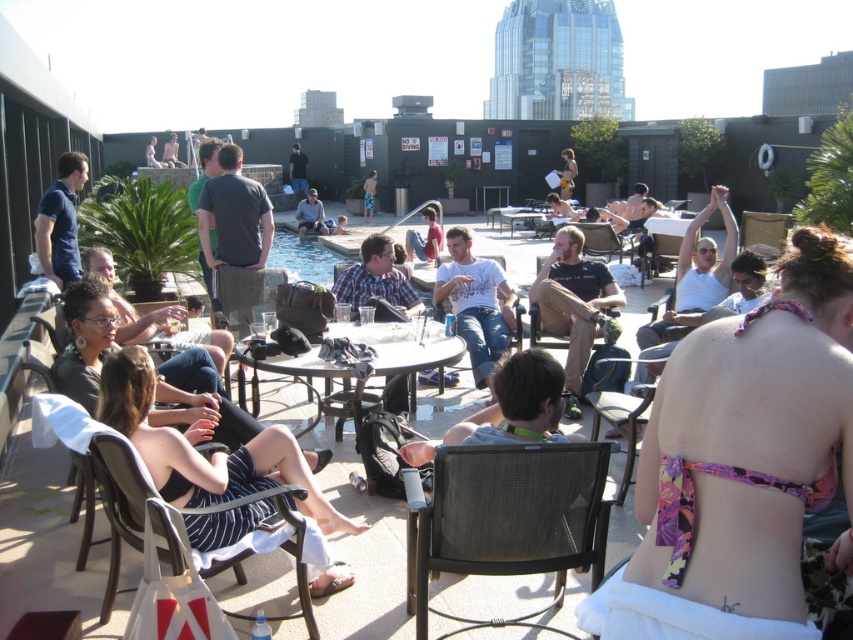
You are standing at the edge of the pool and want to grab your yellow fabric shirt at center to dry off. There is a matte black chair at center in the way. Can you reach the shirt without moving the chair?

The matte black chair at center is closer to the viewer than the yellow fabric shirt at center, so you would need to move the chair to access the shirt.

You are a photographer at the rooftop poolside scene. You need to capture a photo that includes both the striped fabric dress at center and the matte black shirt at center. Which one should you place on the left side of your frame to ensure both are in the shot?

The striped fabric dress at center is positioned on the left side of matte black shirt at center, so to include both in the shot, you should place the striped fabric dress at center on the left side of your frame.

You are a guest at the rooftop pool and want to place your blue cotton shirt at upper left on the metallic silver chair at center. Can you easily reach the chair from where your shirt is currently located?

The blue cotton shirt at upper left is further to the viewer than the metallic silver chair at center, so the shirt is closer to you. Therefore, you can easily reach the metallic silver chair at center from the shirt location.